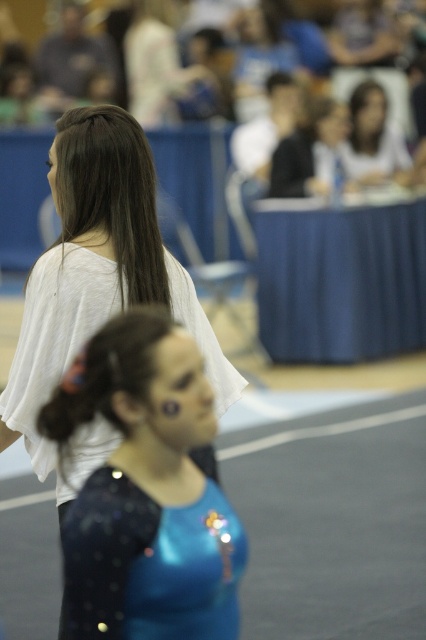
Question: Which point appears closest to the camera in this image?

Choices:
 (A) (203, 593)
 (B) (158, 458)

Answer: (A)

Question: Which object appears closest to the camera in this image?

Choices:
 (A) shiny blue leotard at center
 (B) matte white shirt at upper center
 (C) shiny blue leotard at lower center

Answer: (C)

Question: Is shiny blue leotard at center thinner than shiny blue leotard at lower center?

Choices:
 (A) no
 (B) yes

Answer: (A)

Question: Can you confirm if shiny blue leotard at center is wider than matte white shirt at upper center?

Choices:
 (A) no
 (B) yes

Answer: (A)

Question: Is the position of shiny blue leotard at center more distant than that of shiny blue leotard at lower center?

Choices:
 (A) yes
 (B) no

Answer: (A)

Question: Among these points, which one is nearest to the camera?

Choices:
 (A) (163, 432)
 (B) (362, 147)

Answer: (A)